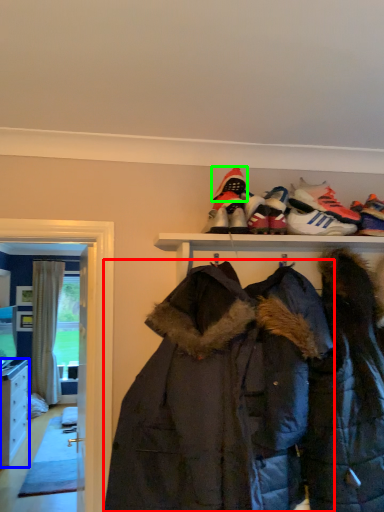
Question: Which object is the closest to the jacket (highlighted by a red box)? Choose among these: cabinetry (highlighted by a blue box) or footwear (highlighted by a green box).

Choices:
 (A) cabinetry
 (B) footwear

Answer: (B)